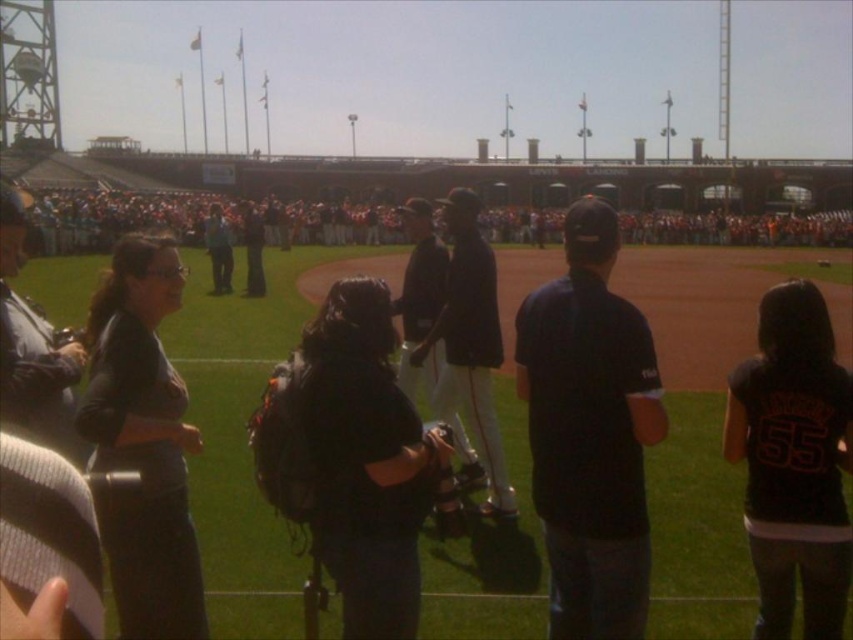
You are standing at the point marked as point [239,440] in the image. What is the nearest object to you?

The nearest object to you at point [239,440] is the dark blue uniform at center.